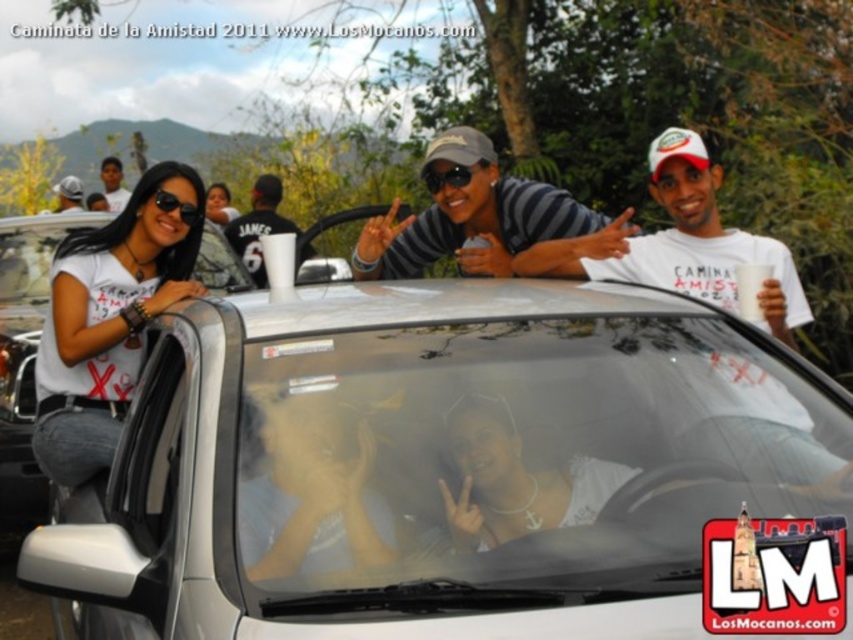
Does white pearl necklace at center come in front of matte black cap at upper left?

Yes, white pearl necklace at center is in front of matte black cap at upper left.

Between point (546, 518) and point (80, 209), which one is positioned in front?

Point (546, 518)

Image resolution: width=853 pixels, height=640 pixels. What are the coordinates of `white pearl necklace at center` in the screenshot? It's located at [x=514, y=481].

In the scene shown: Can you confirm if gray striped shirt at center is positioned below black plastic sunglasses at center?

Yes, gray striped shirt at center is below black plastic sunglasses at center.

Which is in front, point (367, 244) or point (434, 172)?

Positioned in front is point (434, 172).

Locate an element on the screen. gray striped shirt at center is located at coordinates (469, 216).

Is white pearl necklace at center wider than black plastic sunglasses at center?

Indeed, white pearl necklace at center has a greater width compared to black plastic sunglasses at center.

Between point (509, 540) and point (463, 173), which one is positioned in front?

Point (509, 540)

Find the location of a particular element. The width and height of the screenshot is (853, 640). white pearl necklace at center is located at coordinates (514, 481).